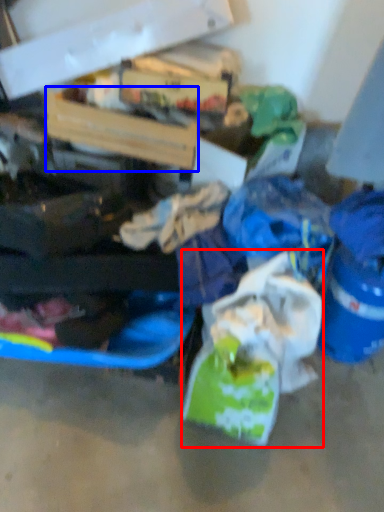
Question: Which object appears closest to the camera in this image, plastic bag (highlighted by a red box) or box (highlighted by a blue box)?

Choices:
 (A) plastic bag
 (B) box

Answer: (A)